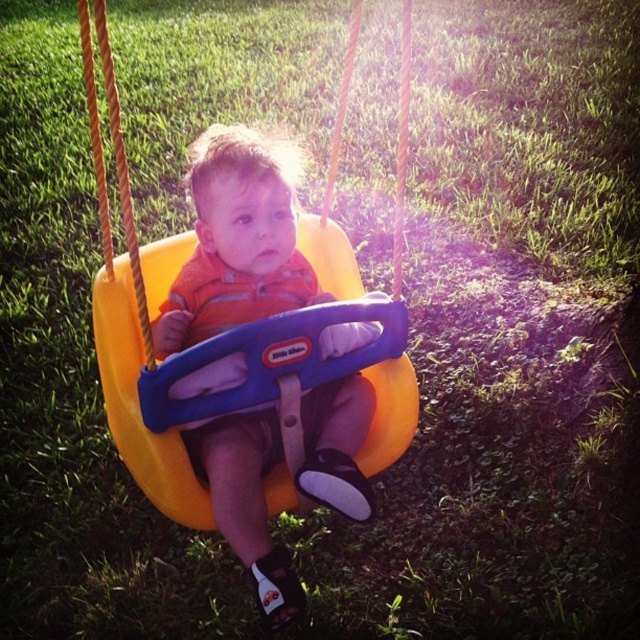
Question: Can you confirm if yellow plastic swing at center is wider than matte orange swing at center?

Choices:
 (A) no
 (B) yes

Answer: (B)

Question: Does yellow plastic swing at center have a greater width compared to matte orange swing at center?

Choices:
 (A) no
 (B) yes

Answer: (B)

Question: Is yellow plastic swing at center wider than matte orange swing at center?

Choices:
 (A) no
 (B) yes

Answer: (B)